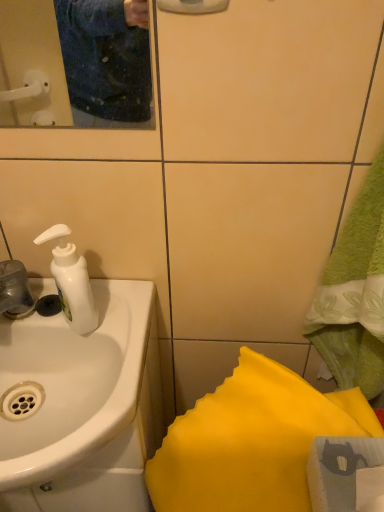
Question: From a real-world perspective, is matte plastic mirror at upper left above or below white glossy sink at left?

Choices:
 (A) below
 (B) above

Answer: (B)

Question: From the image's perspective, is matte plastic mirror at upper left above or below white glossy sink at left?

Choices:
 (A) above
 (B) below

Answer: (A)

Question: Based on their relative distances, which object is farther from the matte plastic mirror at upper left?

Choices:
 (A) yellow fabric at lower right
 (B) white glossy sink at left

Answer: (A)

Question: Considering the real-world distances, which object is closest to the yellow fabric at lower right?

Choices:
 (A) matte plastic mirror at upper left
 (B) white glossy sink at left

Answer: (B)